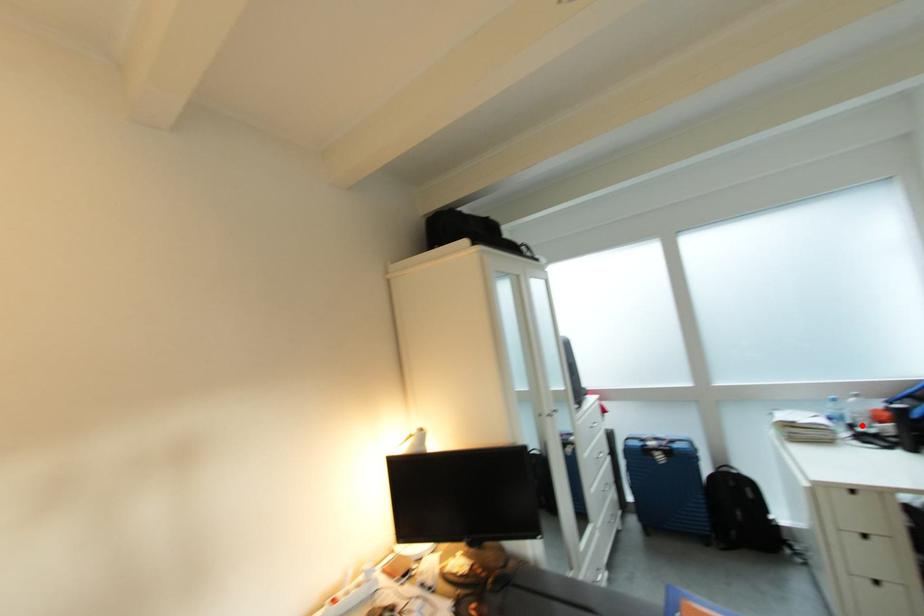
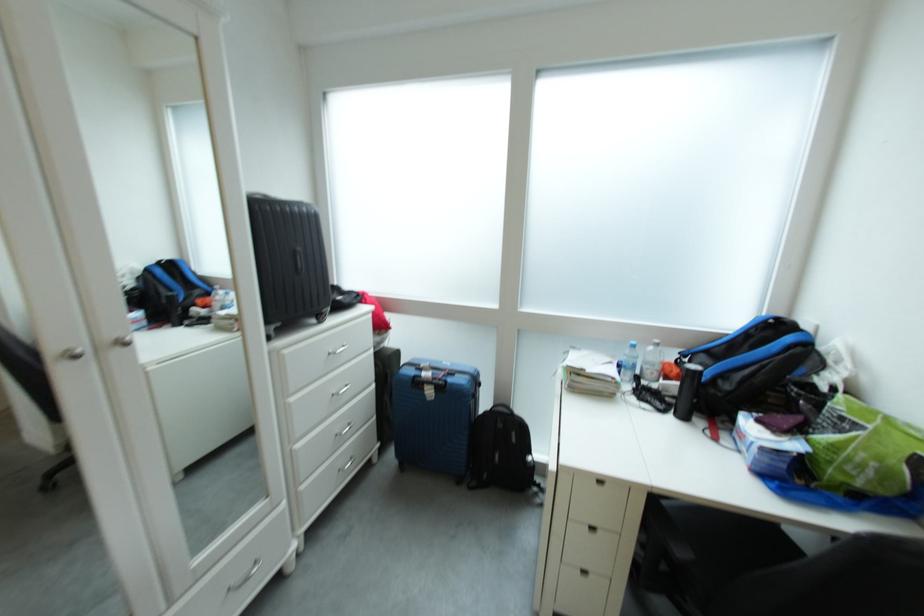
The point at the highlighted location is marked in the first image. Where is the corresponding point in the second image?

(650, 376)